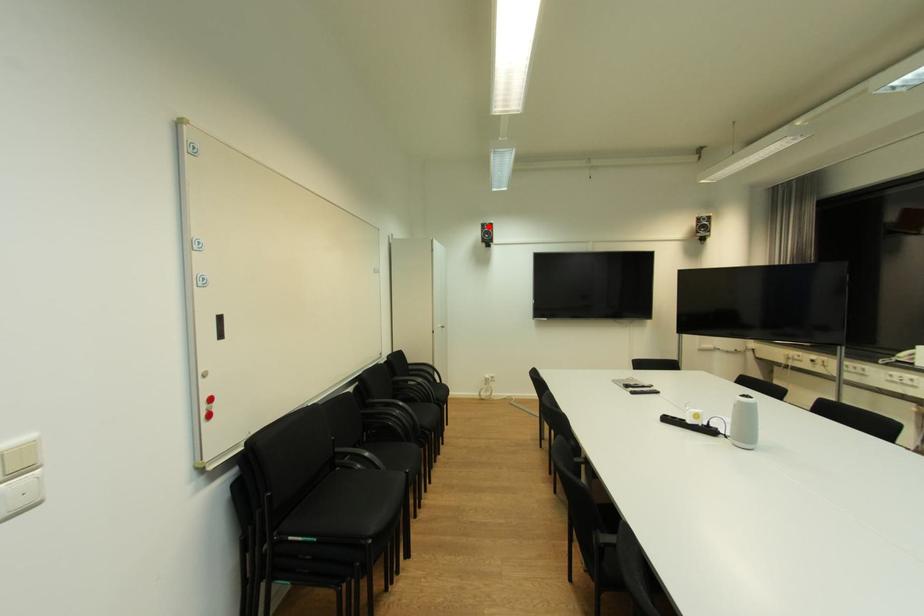
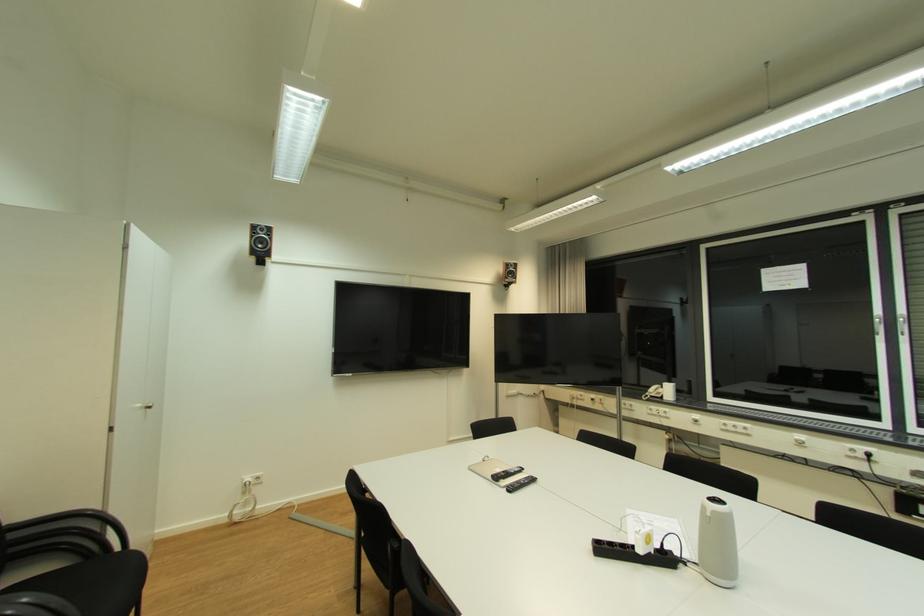
Find the pixel in the second image that matches the highlighted location in the first image.

(261, 228)